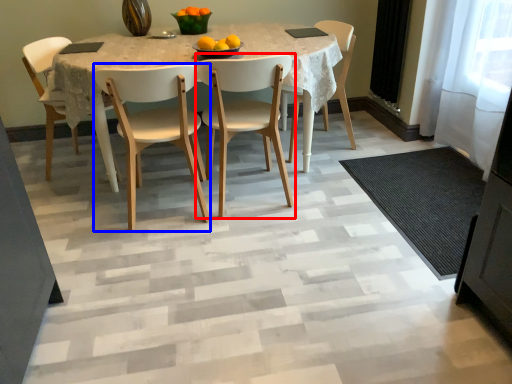
Question: Which point is closer to the camera, chair (highlighted by a red box) or chair (highlighted by a blue box)?

Choices:
 (A) chair
 (B) chair

Answer: (B)